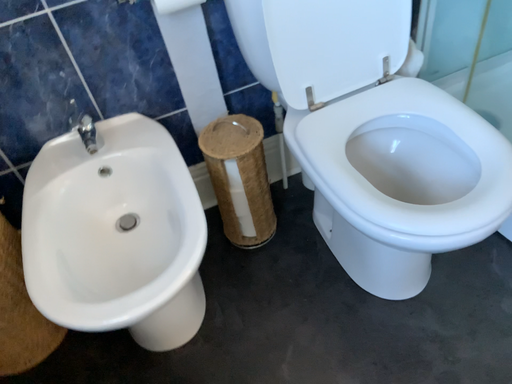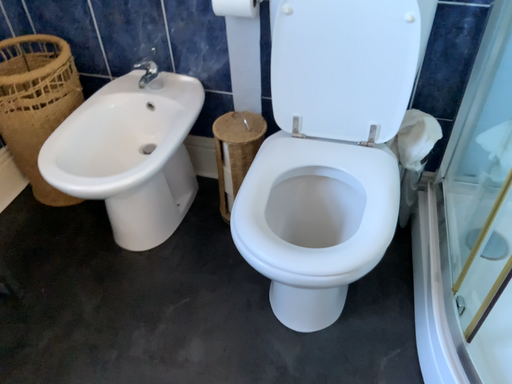
Question: Which way did the camera rotate in the video?

Choices:
 (A) rotated downward
 (B) rotated upward

Answer: (B)